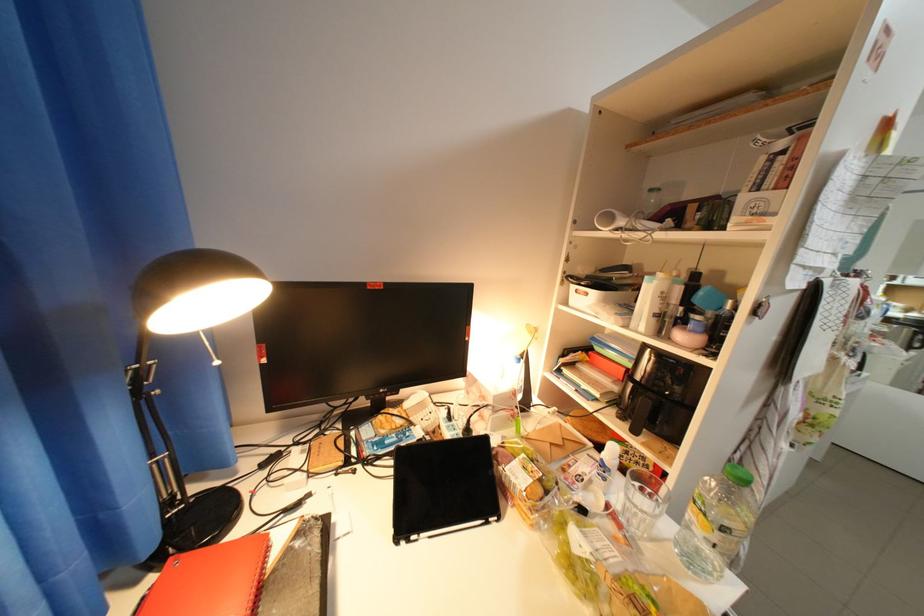
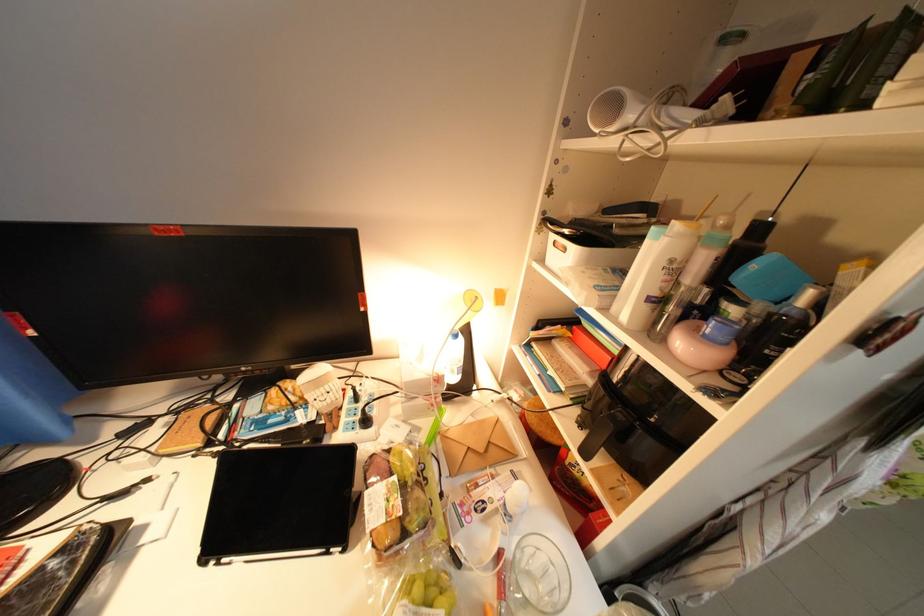
Locate, in the second image, the point that corresponds to pixel 622 219 in the first image.

(625, 108)